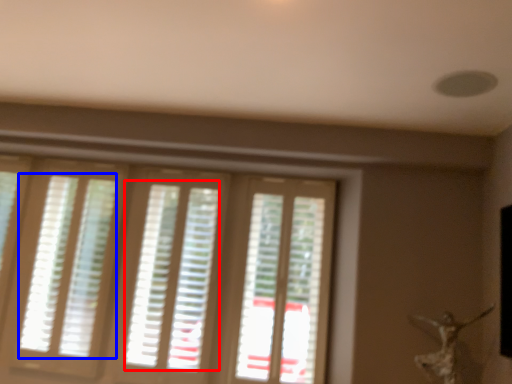
Question: Which point is closer to the camera, blind (highlighted by a red box) or blind (highlighted by a blue box)?

Choices:
 (A) blind
 (B) blind

Answer: (A)